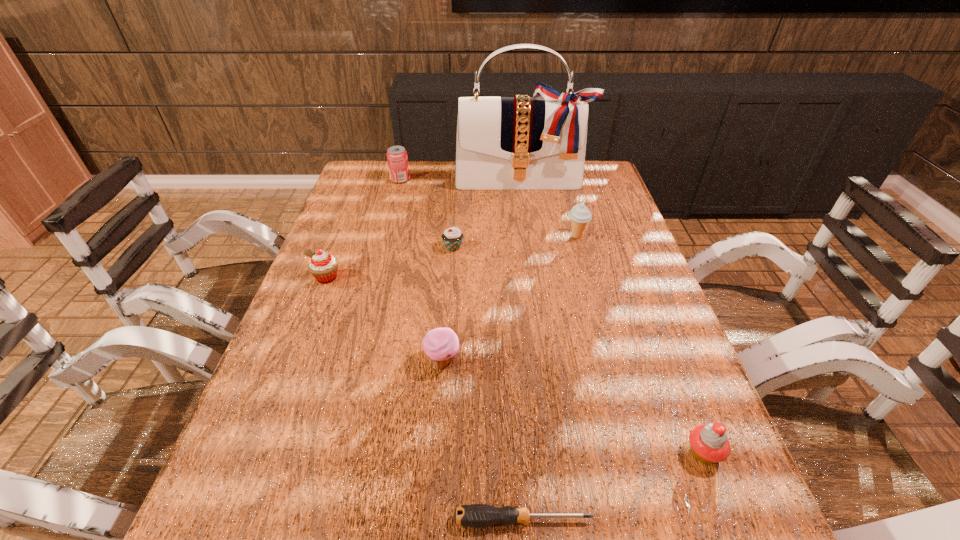
The width and height of the screenshot is (960, 540). I want to click on empty space between the tallest object and the leftmost object, so click(x=424, y=229).

Locate an element on the screen. The height and width of the screenshot is (540, 960). free point between the rightmost object and the shortest object is located at coordinates (613, 486).

At what (x,y) coordinates should I click in order to perform the action: click on free space between the shortest object and the satchel. Please return your answer as a coordinate pair (x, y). The image size is (960, 540). Looking at the image, I should click on pyautogui.click(x=522, y=350).

You are a GUI agent. You are given a task and a screenshot of the screen. Output one action in this format:
    pyautogui.click(x=<x>, y=<y>)
    Task: Click on the object that is the sixth closest to the seventh object from right to left
    
    Given the screenshot: What is the action you would take?
    pyautogui.click(x=475, y=515)

Where is `object that stands as the sixth closest to the icecream`? The image size is (960, 540). object that stands as the sixth closest to the icecream is located at coordinates (323, 266).

At what (x,y) coordinates should I click in order to perform the action: click on the third closest cupcake to the satchel. Please return your answer as a coordinate pair (x, y). The width and height of the screenshot is (960, 540). Looking at the image, I should click on (441, 345).

The image size is (960, 540). Identify the location of cupcake that stands as the third closest to the rightmost object. (323, 266).

Identify the location of vacant space that satisfies the following two spatial constraints: 1. on the front side of the leftmost object; 2. on the right side of the third farthest cupcake. The height and width of the screenshot is (540, 960). (295, 361).

Identify the location of free space in the image that satisfies the following two spatial constraints: 1. on the back side of the icecream; 2. on the right side of the farthest cupcake. The image size is (960, 540). (453, 237).

Identify the location of vacant space that satisfies the following two spatial constraints: 1. on the front-facing side of the tallest object; 2. on the left side of the rightmost object. (559, 453).